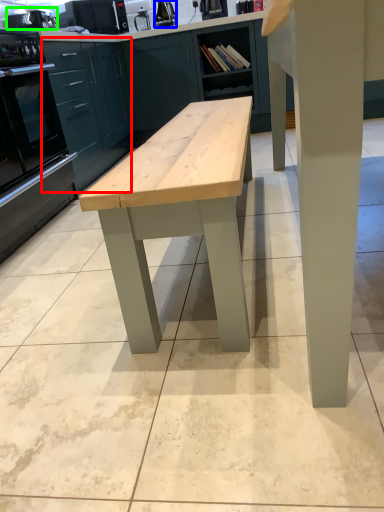
Question: Which is farther away from cabinetry (highlighted by a red box)? appliance (highlighted by a blue box) or appliance (highlighted by a green box)?

Choices:
 (A) appliance
 (B) appliance

Answer: (A)